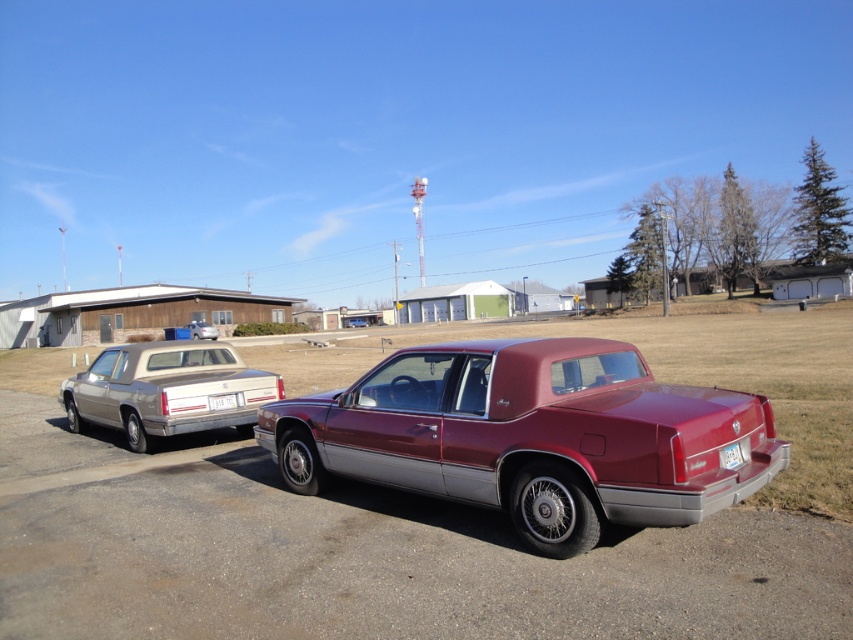
Can you confirm if matte silver sedan at left is shorter than maroon metallic sedan at center?

Incorrect, matte silver sedan at left's height does not fall short of maroon metallic sedan at center's.

Does point (202, 333) lie behind point (364, 324)?

No, it is not.

Between point (198, 333) and point (354, 317), which one is positioned behind?

The point (354, 317) is behind.

Image resolution: width=853 pixels, height=640 pixels. I want to click on matte silver sedan at left, so click(202, 330).

Consider the image. Who is positioned more to the left, white plastic license plate at lower right or white plastic license plate at center?

white plastic license plate at center is more to the left.

Describe the element at coordinates (730, 456) in the screenshot. I see `white plastic license plate at lower right` at that location.

You are a GUI agent. You are given a task and a screenshot of the screen. Output one action in this format:
    pyautogui.click(x=<x>, y=<y>)
    Task: Click on the white plastic license plate at lower right
    This screenshot has height=640, width=853.
    Given the screenshot: What is the action you would take?
    pyautogui.click(x=730, y=456)

Is point (767, 428) less distant than point (366, 324)?

Yes, point (767, 428) is in front of point (366, 324).

Is point (413, 448) farther from camera compared to point (350, 316)?

No, it is not.

Where is `maroon metallic pickup truck at center`? maroon metallic pickup truck at center is located at coordinates (531, 436).